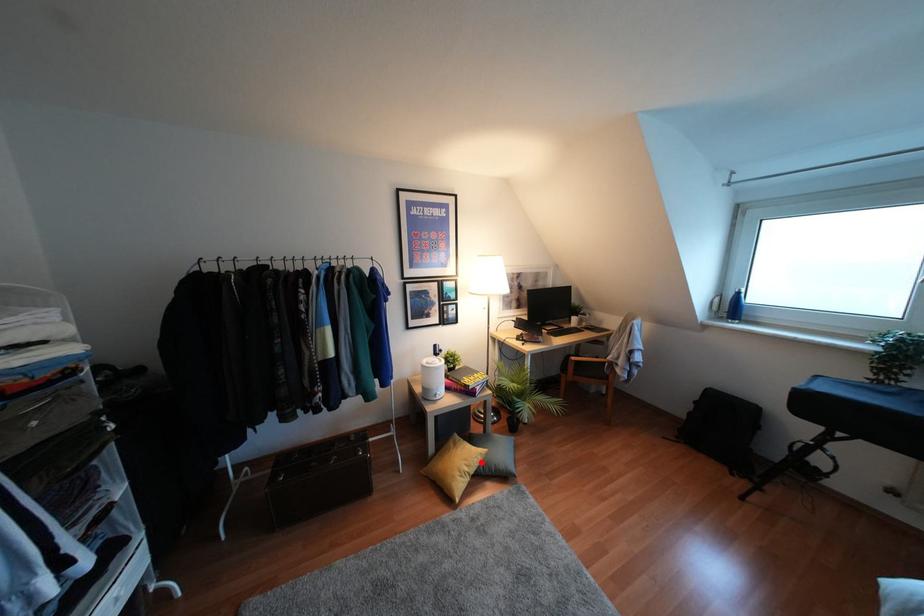
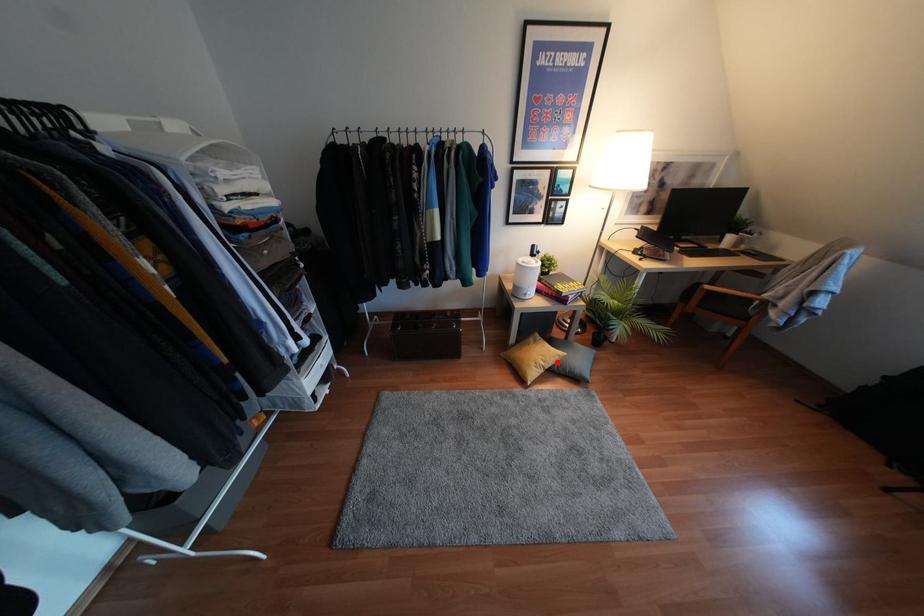
I am providing you with two images of the same scene from different viewpoints. A red point is marked on the first image and another point is marked on the second image. Does the point marked in image1 correspond to the same location as the one in image2?

Yes